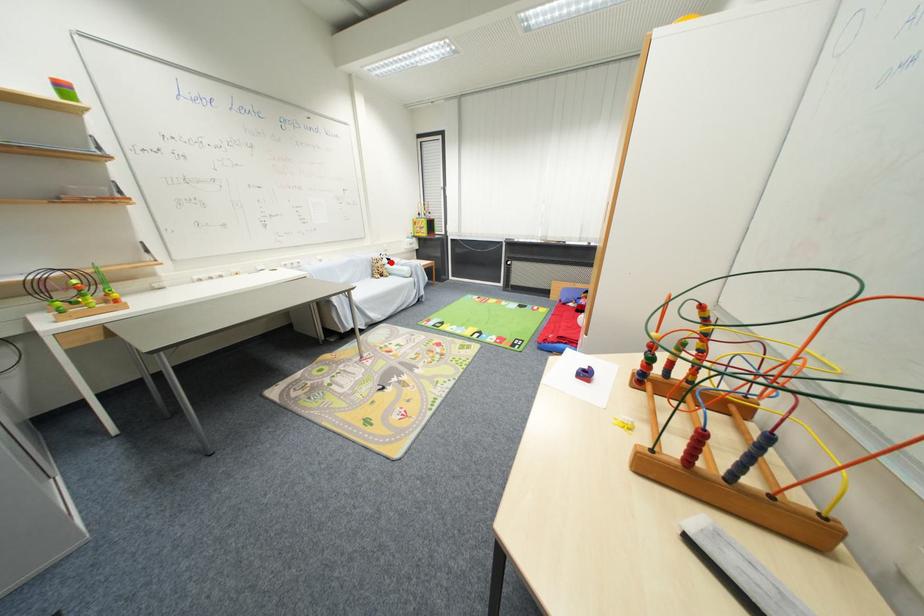
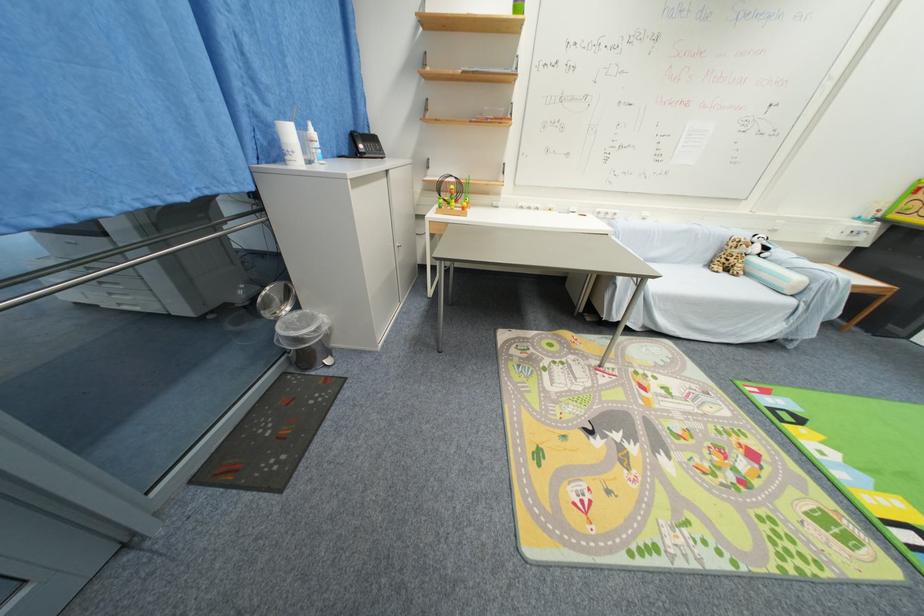
Locate, in the second image, the point that corresponds to the highlighted location in the first image.

(761, 251)